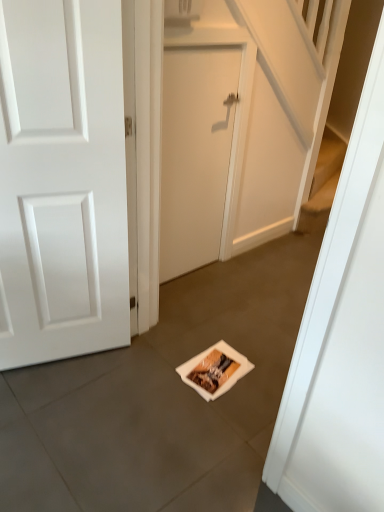
Question: Visually, is beige matte door at center, which is counted as the 1th door, starting from the right, positioned to the left or to the right of white matte door at left, placed as the second door when sorted from right to left?

Choices:
 (A) right
 (B) left

Answer: (A)

Question: Is beige matte door at center, positioned as the second door in left-to-right order, bigger or smaller than white matte door at left, placed as the second door when sorted from right to left?

Choices:
 (A) big
 (B) small

Answer: (B)

Question: Does point (198, 200) appear closer or farther from the camera than point (105, 106)?

Choices:
 (A) farther
 (B) closer

Answer: (A)

Question: From a real-world perspective, is white matte door at left, arranged as the 1th door when viewed from the left, above or below beige matte door at center, which is counted as the 1th door, starting from the right?

Choices:
 (A) below
 (B) above

Answer: (B)

Question: Visually, is white matte door at left, placed as the second door when sorted from right to left, positioned to the left or to the right of beige matte door at center, positioned as the second door in left-to-right order?

Choices:
 (A) right
 (B) left

Answer: (B)

Question: Is white matte door at left, arranged as the 1th door when viewed from the left, in front of or behind beige matte door at center, which is counted as the 1th door, starting from the right, in the image?

Choices:
 (A) behind
 (B) front

Answer: (B)

Question: Looking at the image, does white matte door at left, placed as the second door when sorted from right to left, seem bigger or smaller compared to beige matte door at center, which is counted as the 1th door, starting from the right?

Choices:
 (A) big
 (B) small

Answer: (A)